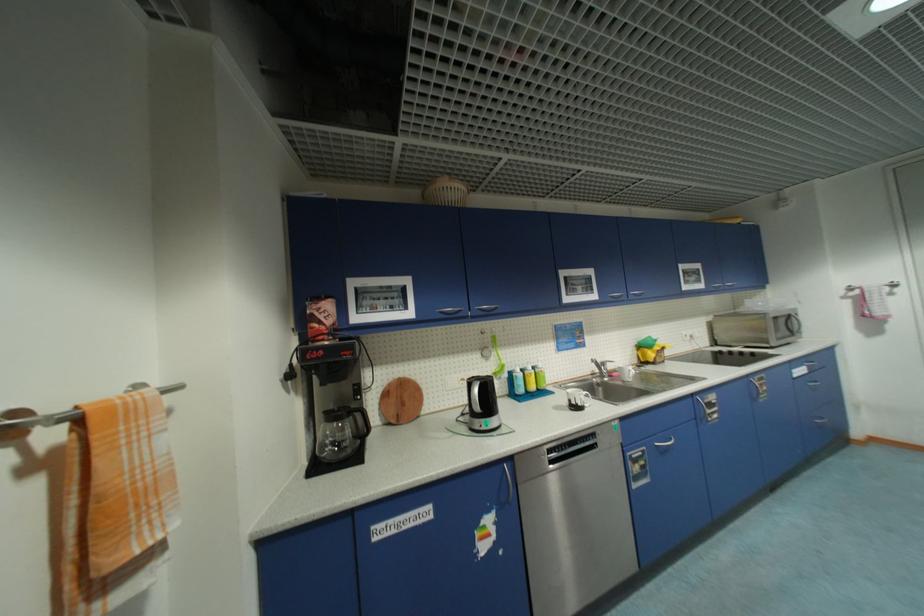
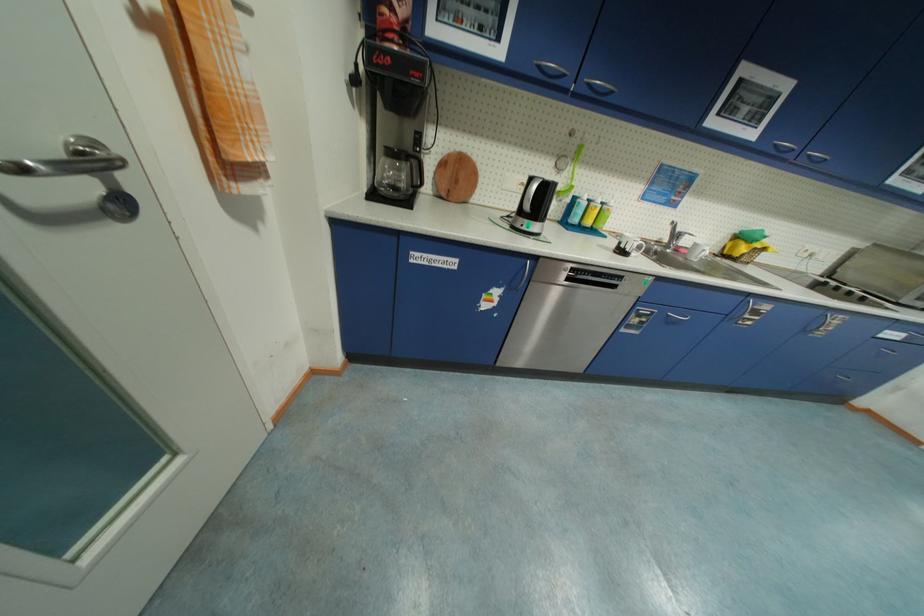
Where in the second image is the point corresponding to the point at 497,359 from the first image?

(570, 175)